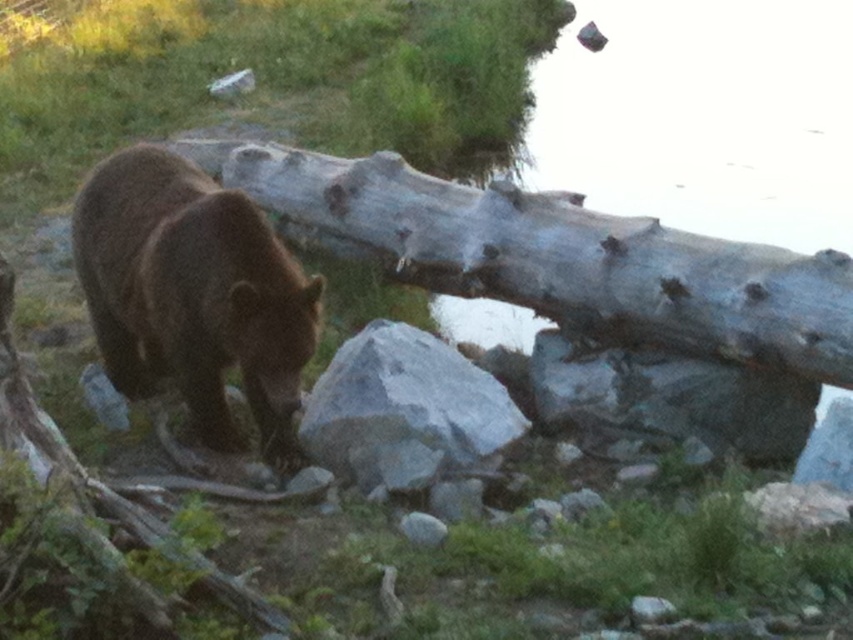
You are a photographer trying to capture a wide shot of the brown furry bear at lower left and the gray rock at center. Your camera can only focus on objects wider than 2 meters. Based on the scene, which object is wider and will be in focus?

The brown furry bear at lower left is wider than the gray rock at center, so the brown furry bear at lower left will be in focus since it surpasses the 2 meter width requirement.

From the picture: You are a hiker who wants to place a 1 meter long hiking stick between the brown furry bear at lower left and the gray rock at center. Can you fit the stick between them?

The distance between the brown furry bear at lower left and the gray rock at center is 66.14 centimeters. Since the stick is 1 meter long, which is longer than the available space, it won